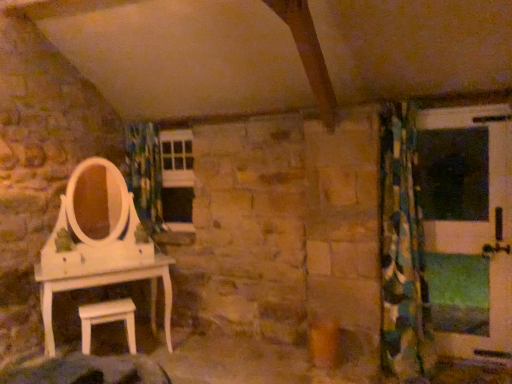
Question: Relative to green matte screen door at right, is green and blue patterned curtain at right in front or behind?

Choices:
 (A) front
 (B) behind

Answer: (A)

Question: Choose the correct answer: Is green and blue patterned curtain at right inside green matte screen door at right or outside it?

Choices:
 (A) outside
 (B) inside

Answer: (A)

Question: Which of these objects is positioned closest to the white matte stool at lower left?

Choices:
 (A) blue-green patterned fabric at center
 (B) green and blue patterned curtain at right
 (C) green matte screen door at right

Answer: (A)

Question: Which of these objects is positioned closest to the white matte stool at lower left?

Choices:
 (A) blue-green patterned fabric at center
 (B) green matte screen door at right
 (C) green and blue patterned curtain at right

Answer: (A)